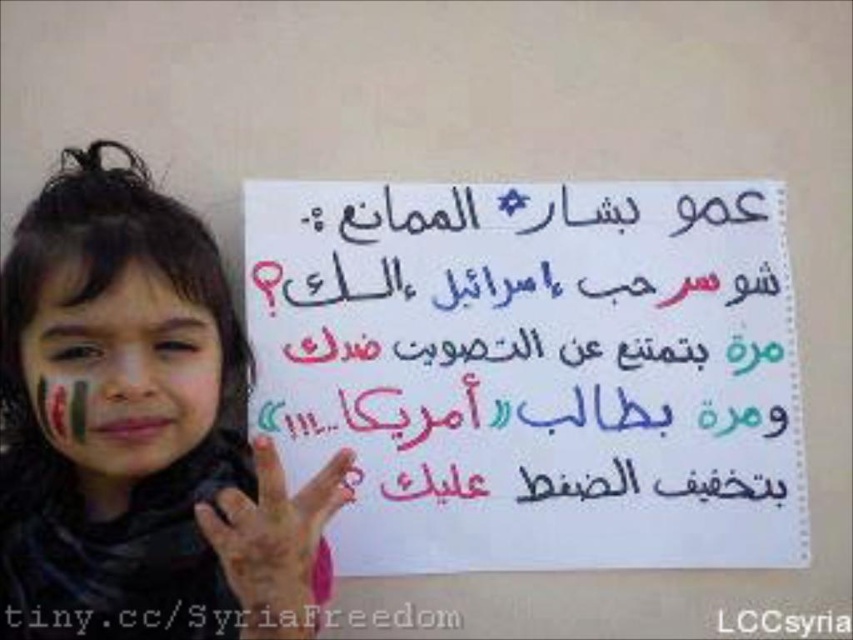
Question: Considering the relative positions of white paper at center and matte plastic face at center in the image provided, where is white paper at center located with respect to matte plastic face at center?

Choices:
 (A) left
 (B) right

Answer: (B)

Question: Which of the following is the farthest from the observer?

Choices:
 (A) matte black scarf at center
 (B) pink matte hand at center
 (C) white paper at center

Answer: (C)

Question: Is matte black scarf at center wider than pink matte hand at center?

Choices:
 (A) no
 (B) yes

Answer: (B)

Question: Among these objects, which one is nearest to the camera?

Choices:
 (A) matte black scarf at center
 (B) white paper at center
 (C) matte plastic face at center

Answer: (A)

Question: Considering the real-world distances, which object is farthest from the matte black scarf at center?

Choices:
 (A) matte plastic face at center
 (B) white paper at center

Answer: (B)

Question: Is white paper at center bigger than matte plastic face at center?

Choices:
 (A) no
 (B) yes

Answer: (B)